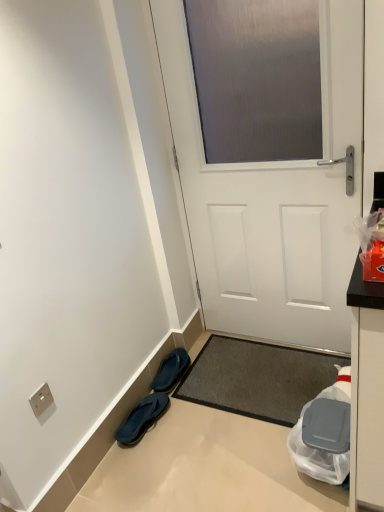
Identify the location of vacant region to the right of blue rubber flip-flops at lower left, the second footwear in the front-to-back sequence. The height and width of the screenshot is (512, 384). (208, 371).